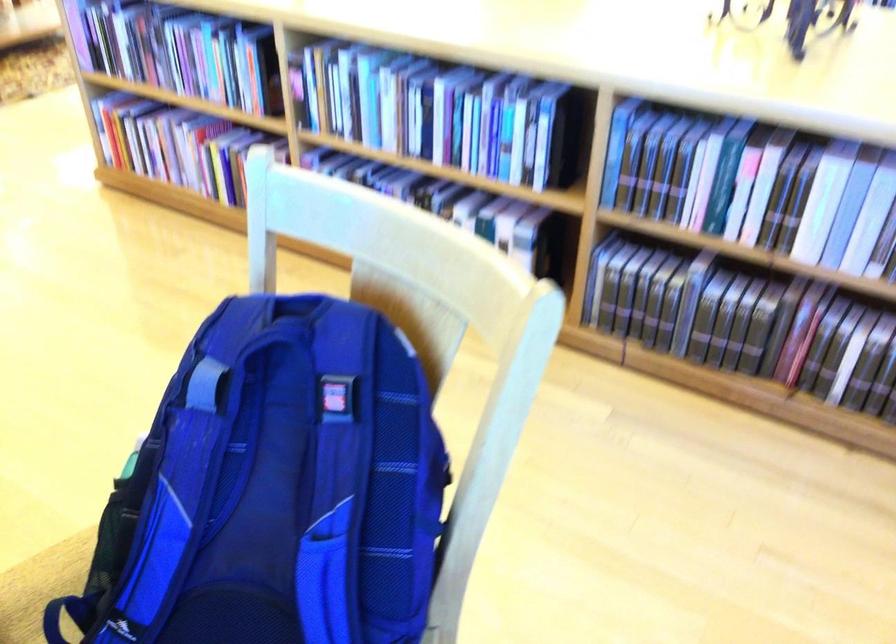
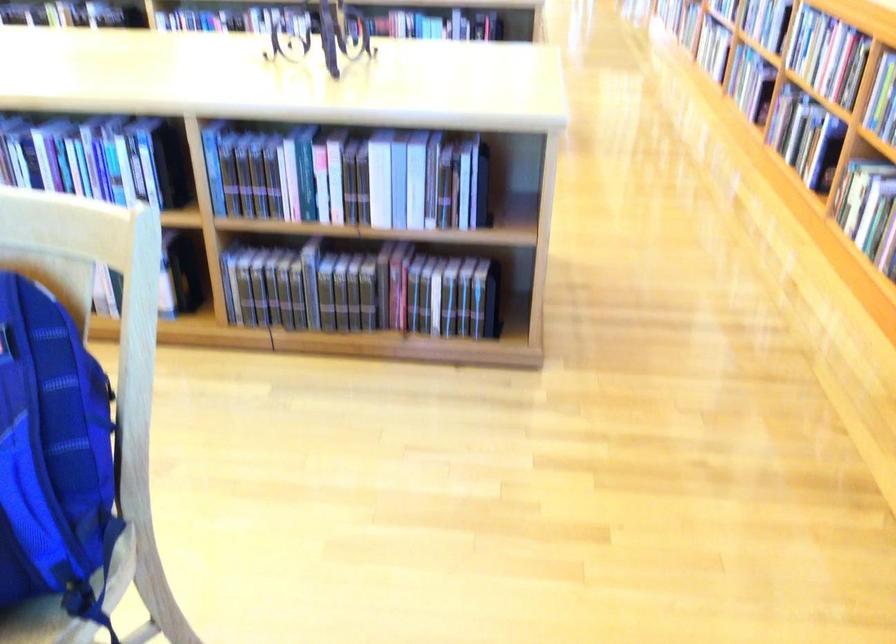
Locate, in the second image, the point that corresponds to the point at 619,152 in the first image.

(213, 164)